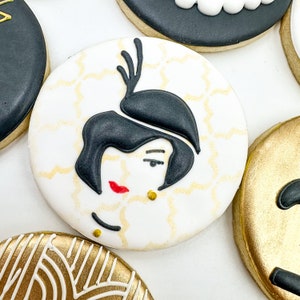
Identify the location of white table top. Image resolution: width=300 pixels, height=300 pixels. (57, 16).